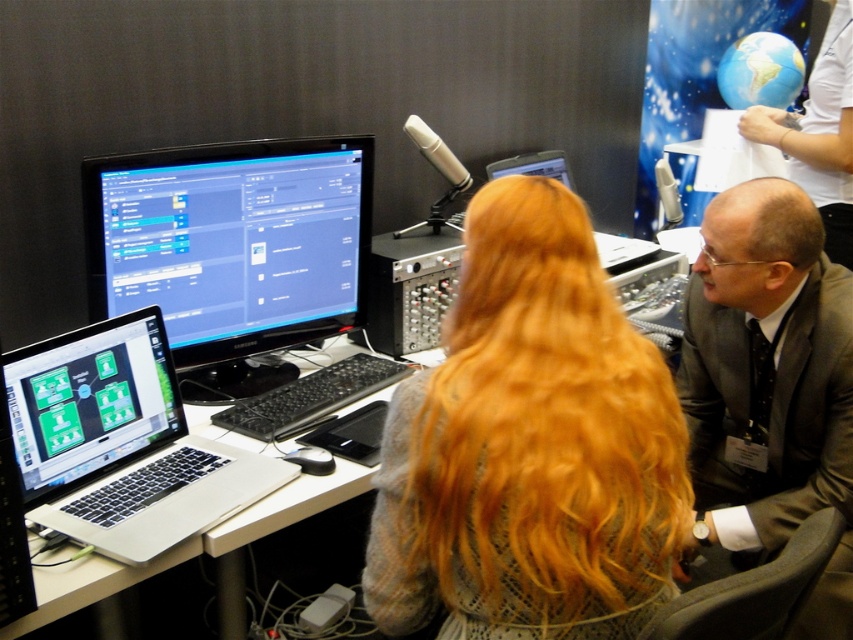
Can you confirm if blonde hair at center is positioned above silver/black laptop at lower left?

Yes.

Can you confirm if blonde hair at center is positioned to the left of silver/black laptop at lower left?

In fact, blonde hair at center is to the right of silver/black laptop at lower left.

Is point (482, 259) farther from viewer compared to point (136, 321)?

That is False.

Where is `blonde hair at center`? This screenshot has width=853, height=640. blonde hair at center is located at coordinates (531, 445).

Can you confirm if silver/black laptop at lower left is smaller than matte black laptop at left?

No.

Does point (209, 496) come behind point (71, 449)?

No, (209, 496) is in front of (71, 449).

Find the location of a particular element. silver/black laptop at lower left is located at coordinates (120, 442).

Is matte black monitor at center below matte black laptop at left?

No, matte black monitor at center is not below matte black laptop at left.

Identify the location of matte black monitor at center. This screenshot has height=640, width=853. (231, 250).

Where is `matte black monitor at center`? The width and height of the screenshot is (853, 640). matte black monitor at center is located at coordinates (231, 250).